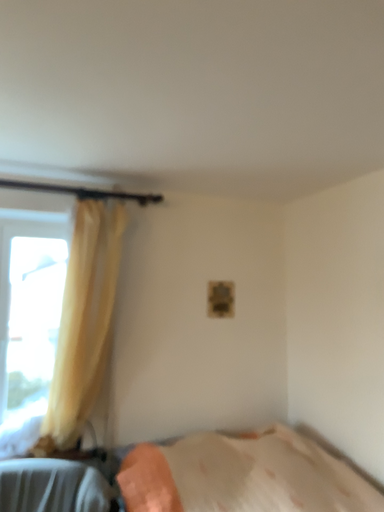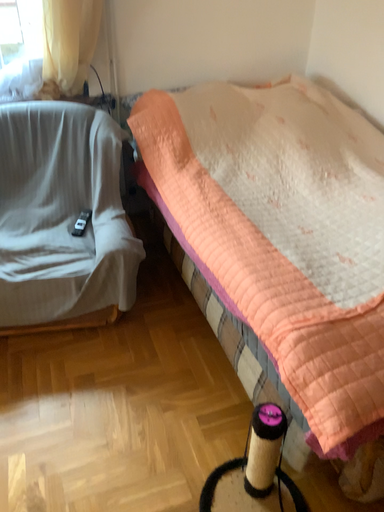
Question: Which way did the camera rotate in the video?

Choices:
 (A) rotated upward
 (B) rotated downward

Answer: (B)